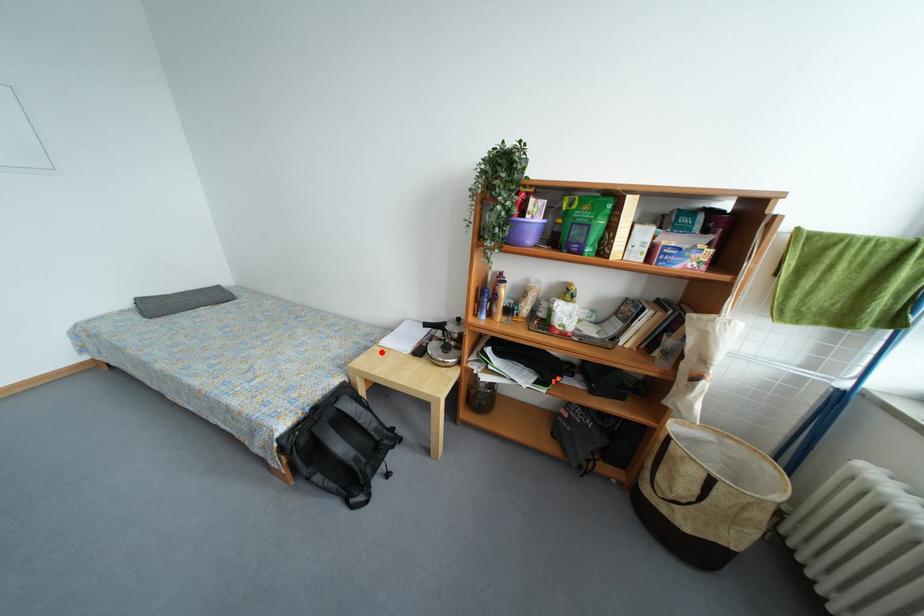
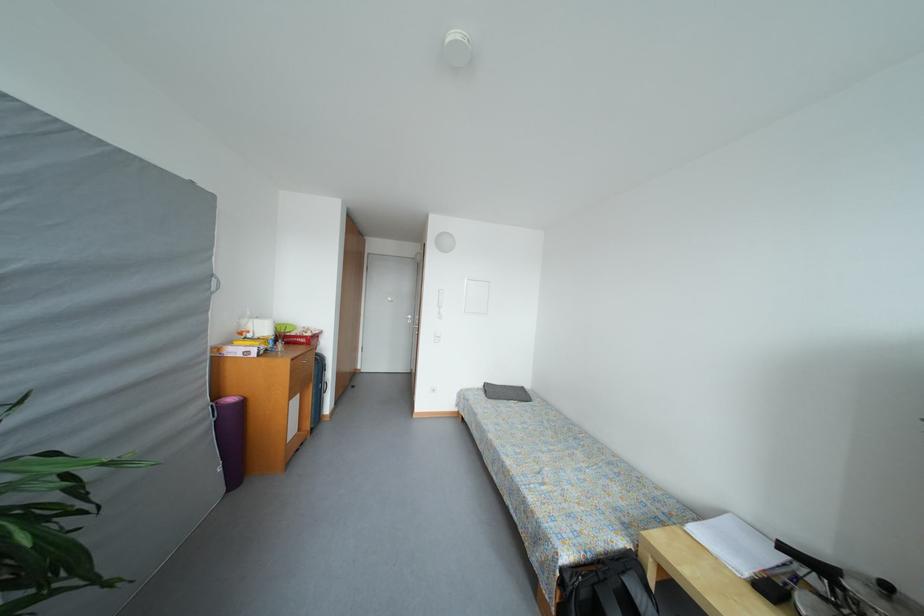
The point at the highlighted location is marked in the first image. Where is the corresponding point in the second image?

(684, 533)